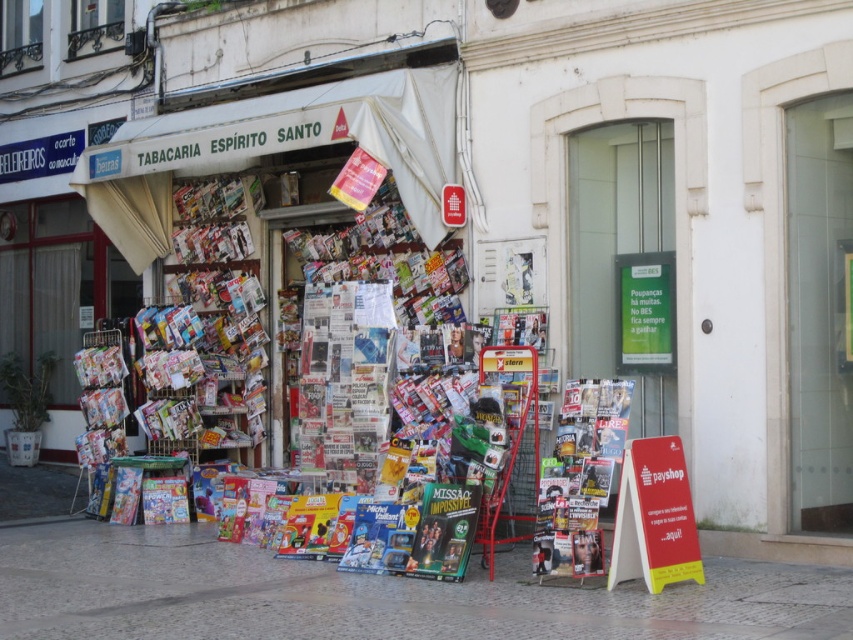
Question: Can you confirm if white fabric canopy at center is positioned to the left of shiny metallic magazine at center?

Choices:
 (A) yes
 (B) no

Answer: (A)

Question: In this image, where is white fabric canopy at center located relative to shiny metallic magazine at center?

Choices:
 (A) left
 (B) right

Answer: (A)

Question: Which of the following is the farthest from the observer?

Choices:
 (A) white fabric canopy at center
 (B) smooth stone pavement at lower center
 (C) shiny metallic magazine at center

Answer: (A)

Question: Which point is closer to the camera taking this photo?

Choices:
 (A) (596, 416)
 (B) (347, 116)
 (C) (213, 580)

Answer: (A)

Question: Estimate the real-world distances between objects in this image. Which object is farther from the smooth stone pavement at lower center?

Choices:
 (A) shiny metallic magazine at center
 (B) white fabric canopy at center

Answer: (B)

Question: Can you confirm if white fabric canopy at center is positioned below shiny metallic magazine at center?

Choices:
 (A) yes
 (B) no

Answer: (B)